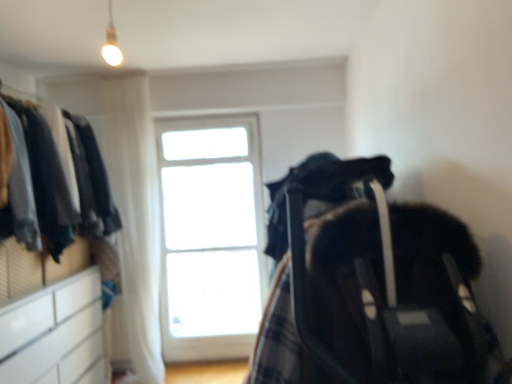
Question: Can you confirm if white glossy dresser at left is positioned to the right of white glass window at center?

Choices:
 (A) no
 (B) yes

Answer: (A)

Question: From the image's perspective, is white glossy dresser at left below white glass window at center?

Choices:
 (A) no
 (B) yes

Answer: (A)

Question: Considering the relative positions of white glossy dresser at left and white glass window at center in the image provided, is white glossy dresser at left behind white glass window at center?

Choices:
 (A) yes
 (B) no

Answer: (B)

Question: Considering the relative sizes of white glossy dresser at left and white glass window at center in the image provided, is white glossy dresser at left thinner than white glass window at center?

Choices:
 (A) no
 (B) yes

Answer: (A)

Question: Is white glossy dresser at left bigger than white glass window at center?

Choices:
 (A) yes
 (B) no

Answer: (A)

Question: Is white glossy/file cabinet at lower left to the left or to the right of white glossy dresser at left in the image?

Choices:
 (A) right
 (B) left

Answer: (B)

Question: Is white glossy/file cabinet at lower left inside the boundaries of white glossy dresser at left, or outside?

Choices:
 (A) inside
 (B) outside

Answer: (B)

Question: Considering the positions of white glossy/file cabinet at lower left and white glossy dresser at left in the image, is white glossy/file cabinet at lower left taller or shorter than white glossy dresser at left?

Choices:
 (A) short
 (B) tall

Answer: (A)

Question: Considering the positions of white glossy/file cabinet at lower left and white glossy dresser at left in the image, is white glossy/file cabinet at lower left wider or thinner than white glossy dresser at left?

Choices:
 (A) thin
 (B) wide

Answer: (A)

Question: Is white glossy dresser at left wider or thinner than white sheer curtain at upper left?

Choices:
 (A) wide
 (B) thin

Answer: (A)

Question: Do you think white glossy dresser at left is within white sheer curtain at upper left, or outside of it?

Choices:
 (A) outside
 (B) inside

Answer: (A)

Question: From a real-world perspective, is white glossy dresser at left physically located above or below white sheer curtain at upper left?

Choices:
 (A) above
 (B) below

Answer: (A)

Question: Does point (52, 352) appear closer or farther from the camera than point (151, 198)?

Choices:
 (A) farther
 (B) closer

Answer: (B)

Question: Is white glass window at center in front of or behind white sheer curtain at upper left in the image?

Choices:
 (A) behind
 (B) front

Answer: (A)

Question: Is white glass window at center spatially inside white sheer curtain at upper left, or outside of it?

Choices:
 (A) inside
 (B) outside

Answer: (B)